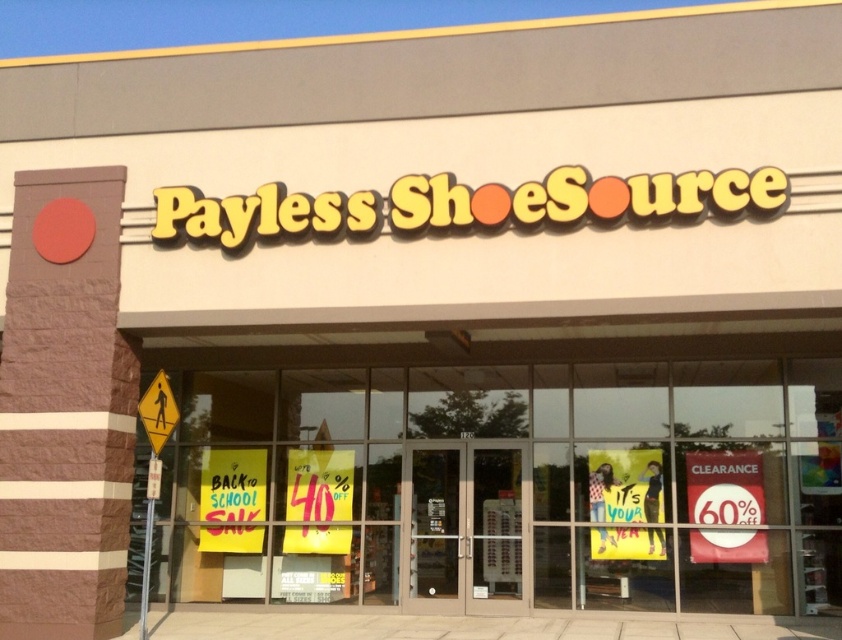
Question: Observing the image, what is the correct spatial positioning of yellow glass window at center in reference to red paper sign at lower right?

Choices:
 (A) above
 (B) below

Answer: (A)

Question: Which object is the closest to the yellow reflective pedestrian crossing sign at lower left?

Choices:
 (A) red paper sign at lower right
 (B) yellow glass window at center

Answer: (B)

Question: Which of these objects is positioned farthest from the yellow reflective pedestrian crossing sign at lower left?

Choices:
 (A) red paper sign at lower right
 (B) yellow glass window at center

Answer: (A)

Question: Estimate the real-world distances between objects in this image. Which object is farther from the red paper sign at lower right?

Choices:
 (A) yellow glass window at center
 (B) yellow reflective pedestrian crossing sign at lower left

Answer: (B)

Question: Does yellow glass window at center have a smaller size compared to red paper sign at lower right?

Choices:
 (A) yes
 (B) no

Answer: (B)

Question: Considering the relative positions of red paper sign at lower right and yellow reflective pedestrian crossing sign at lower left in the image provided, where is red paper sign at lower right located with respect to yellow reflective pedestrian crossing sign at lower left?

Choices:
 (A) right
 (B) left

Answer: (A)